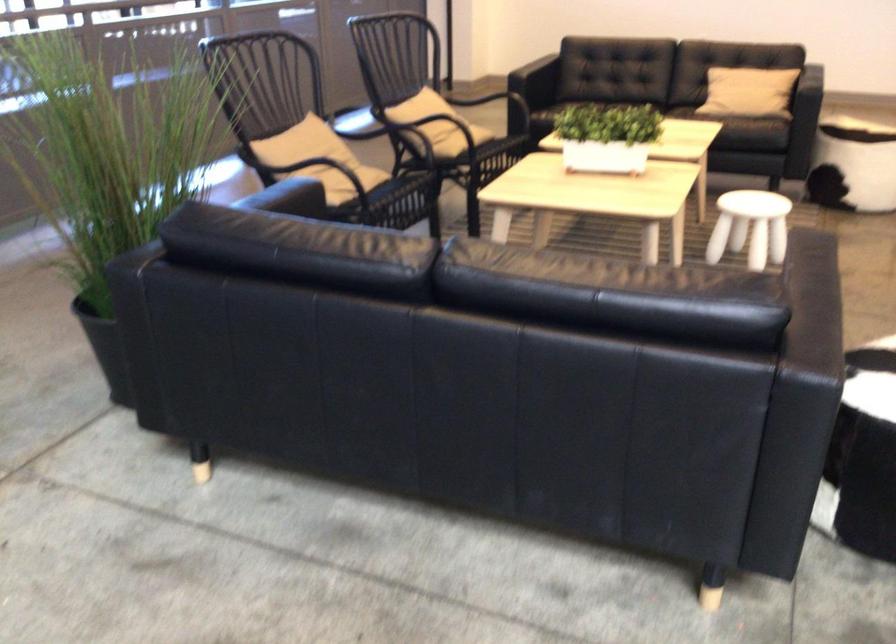
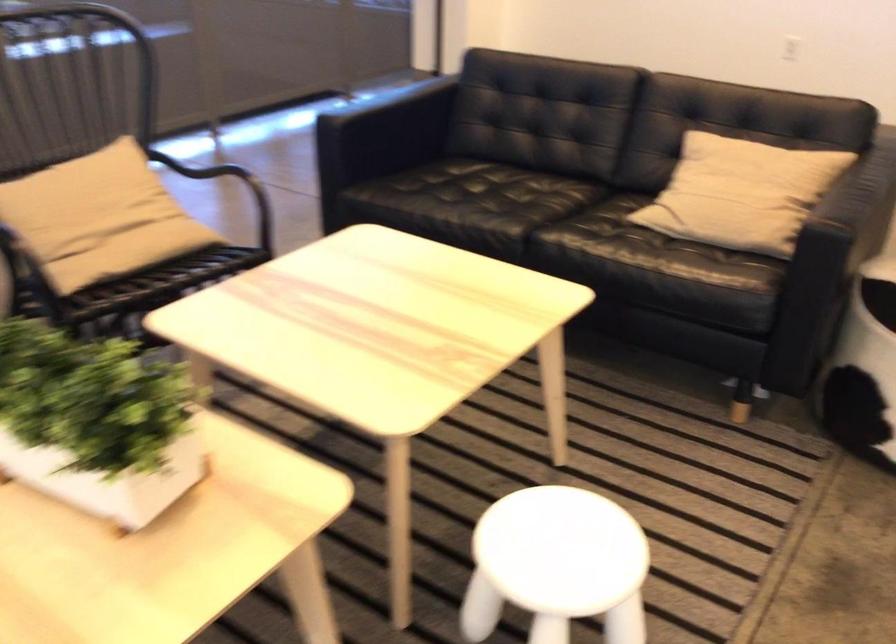
In the second image, find the point that corresponds to pixel 636 126 in the first image.

(96, 422)